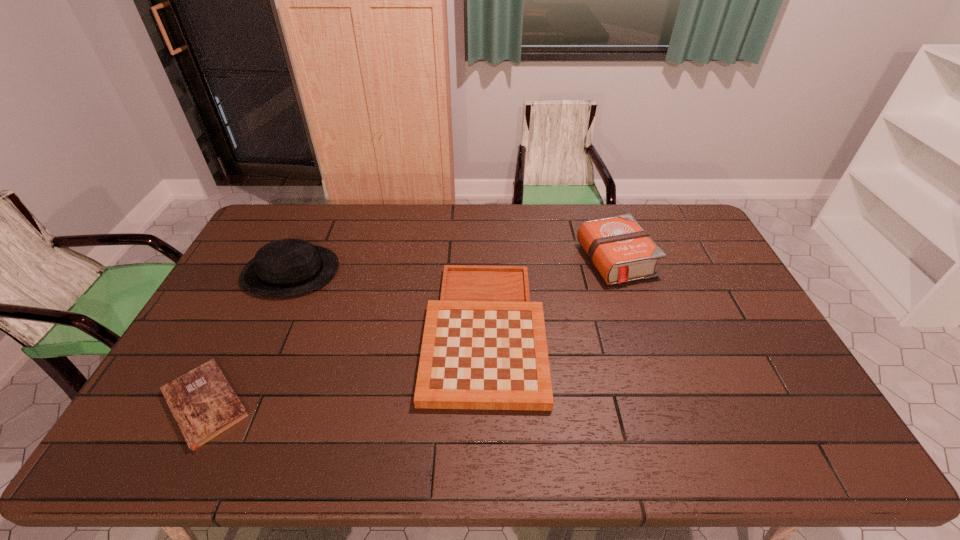
Locate an element on the screen. the rightmost object is located at coordinates (618, 247).

This screenshot has width=960, height=540. Find the location of `the right Bible`. the right Bible is located at coordinates (618, 247).

Where is `fedora`? fedora is located at coordinates (288, 267).

Image resolution: width=960 pixels, height=540 pixels. Find the location of `the second shortest object`. the second shortest object is located at coordinates (484, 346).

The image size is (960, 540). In order to click on the third object from left to right in this screenshot , I will do `click(484, 346)`.

Where is `the nearer Bible`? the nearer Bible is located at coordinates (204, 405).

What are the coordinates of `the shorter Bible` in the screenshot? It's located at (204, 405).

Find the location of a particular element. vacant area located 0.050m on the right of the farther Bible is located at coordinates click(667, 260).

At what (x,y) coordinates should I click in order to perform the action: click on free location located on the front of the fedora. Please return your answer as a coordinate pair (x, y). This screenshot has height=540, width=960. Looking at the image, I should click on (238, 388).

This screenshot has height=540, width=960. I want to click on vacant area located on the left of the gameboard, so click(x=373, y=330).